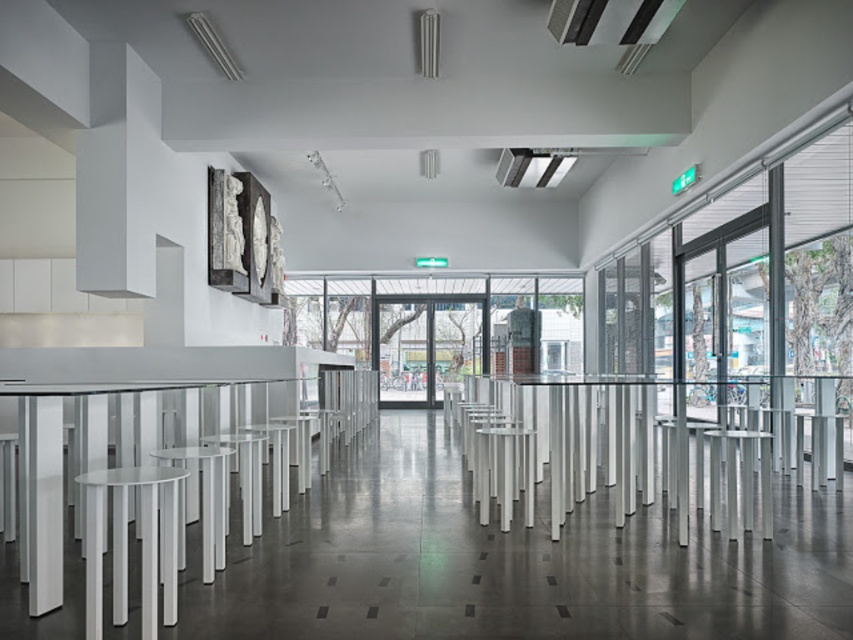
You are standing in the gallery and notice two points marked in the corridor. Which point, point (48, 540) or point (209, 515), is nearer to your current position?

Point (48, 540) is closer to the viewer than point (209, 515), so it is nearer to your current position.

You are standing in the gallery and want to sit down. You see the white glossy table at left and the white plastic bar stool at lower left. Which one is nearer to you?

The white glossy table at left is closer to the viewer than the white plastic bar stool at lower left, so the table is nearer.